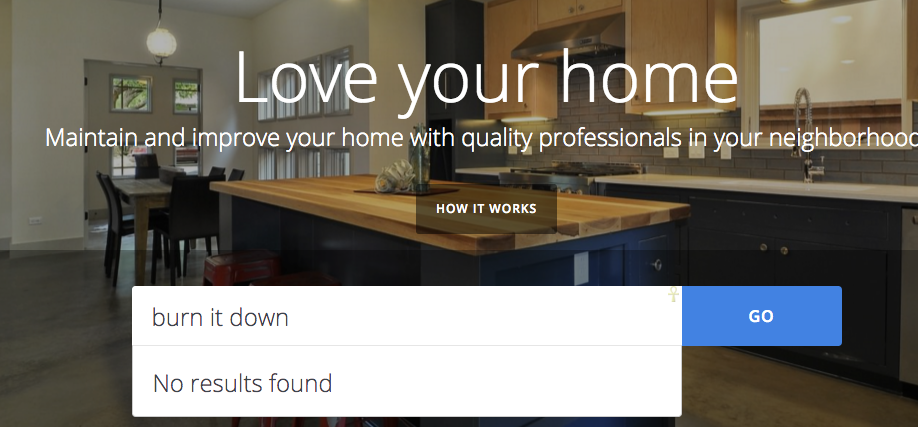
This screenshot has width=918, height=427. In order to click on kitchen hood in this screenshot , I will do `click(585, 39)`.